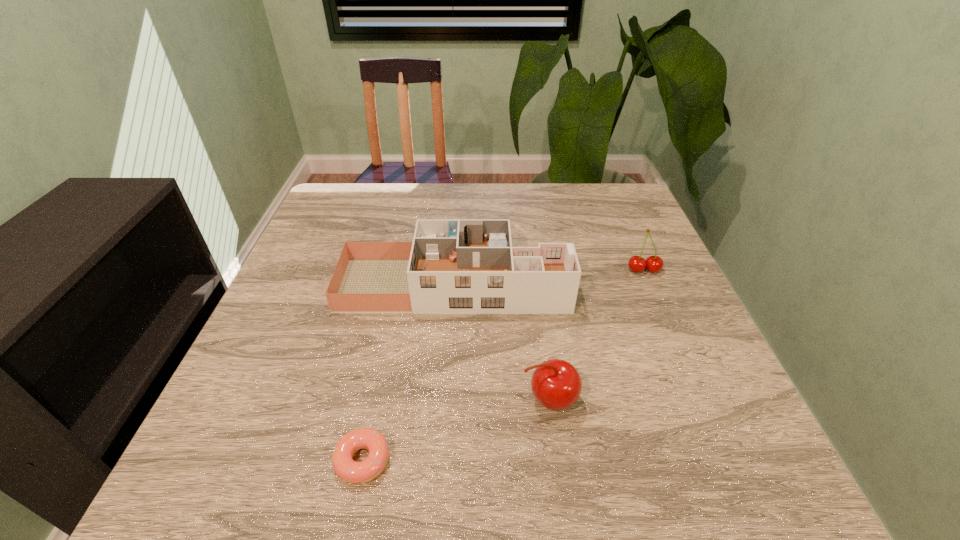
Find the location of a particular element. vacant space situated 0.320m on the right of the nearest object is located at coordinates (588, 461).

You are a GUI agent. You are given a task and a screenshot of the screen. Output one action in this format:
    pyautogui.click(x=<x>, y=<y>)
    Task: Click on the object present at the near edge
    The height and width of the screenshot is (540, 960).
    Given the screenshot: What is the action you would take?
    pyautogui.click(x=351, y=471)

You are a GUI agent. You are given a task and a screenshot of the screen. Output one action in this format:
    pyautogui.click(x=<x>, y=<y>)
    Task: Click on the object that is at the left edge
    Image resolution: width=960 pixels, height=540 pixels.
    Given the screenshot: What is the action you would take?
    pyautogui.click(x=453, y=266)

Find the location of a particular element. This screenshot has width=960, height=540. object that is at the right edge is located at coordinates (654, 264).

You are a GUI agent. You are given a task and a screenshot of the screen. Output one action in this format:
    pyautogui.click(x=<x>, y=<y>)
    Task: Click on the vacant space at the far edge
    
    Given the screenshot: What is the action you would take?
    pyautogui.click(x=430, y=186)

I want to click on free space at the near edge of the desktop, so click(476, 461).

The image size is (960, 540). What are the coordinates of `blank space at the left edge` in the screenshot? It's located at (304, 360).

Image resolution: width=960 pixels, height=540 pixels. In the image, there is a desktop. What are the coordinates of `vacant space at the right edge` in the screenshot? It's located at (679, 286).

What are the coordinates of `vacant space at the far right corner` in the screenshot? It's located at (613, 188).

You are a GUI agent. You are given a task and a screenshot of the screen. Output one action in this format:
    pyautogui.click(x=<x>, y=<y>)
    Task: Click on the free space at the near right corner of the desktop
    
    Given the screenshot: What is the action you would take?
    pyautogui.click(x=668, y=445)